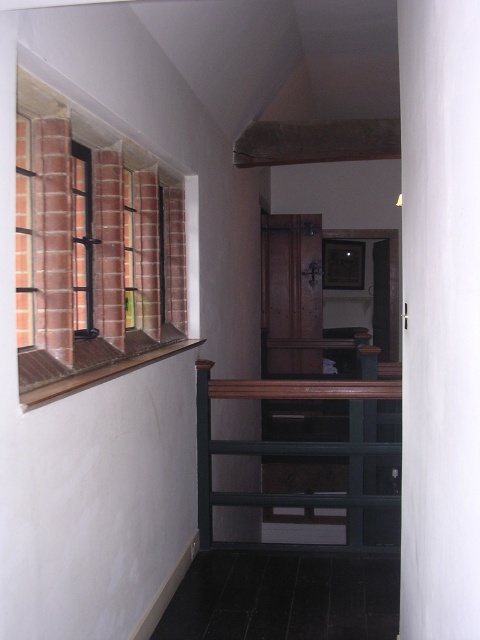
Is brick textured window at upper left above brick textured window at left?

No.

In the scene shown: Which is below, brick textured window at upper left or brick textured window at left?

brick textured window at upper left is below.

Between point (180, 284) and point (72, 144), which one is positioned behind?

Positioned behind is point (180, 284).

At what (x,y) coordinates should I click in order to perform the action: click on brick textured window at upper left. Please return your answer as a coordinate pair (x, y). The width and height of the screenshot is (480, 640). Looking at the image, I should click on (91, 250).

Does dark green painted wood at center appear on the left side of brick textured window at left?

In fact, dark green painted wood at center is to the right of brick textured window at left.

Is dark green painted wood at center wider than brick textured window at left?

Yes, dark green painted wood at center is wider than brick textured window at left.

Describe the element at coordinates (296, 445) in the screenshot. I see `dark green painted wood at center` at that location.

Locate an element on the screen. The height and width of the screenshot is (640, 480). dark green painted wood at center is located at coordinates (296, 445).

Does point (62, 292) lie in front of point (317, 397)?

Yes.

Who is lower down, brick textured window at upper left or dark green painted wood at center?

dark green painted wood at center is below.

Where is `brick textured window at upper left`? This screenshot has height=640, width=480. brick textured window at upper left is located at coordinates (91, 250).